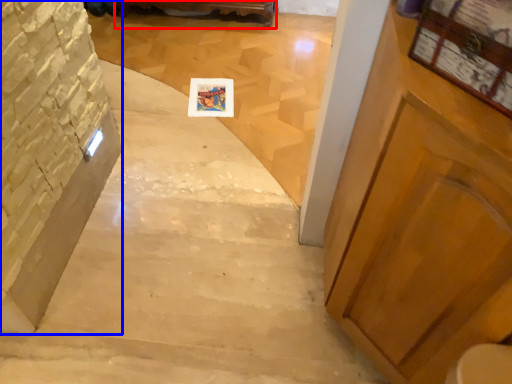
Question: Among these objects, which one is nearest to the camera, furniture (highlighted by a red box) or stairwell (highlighted by a blue box)?

Choices:
 (A) furniture
 (B) stairwell

Answer: (B)